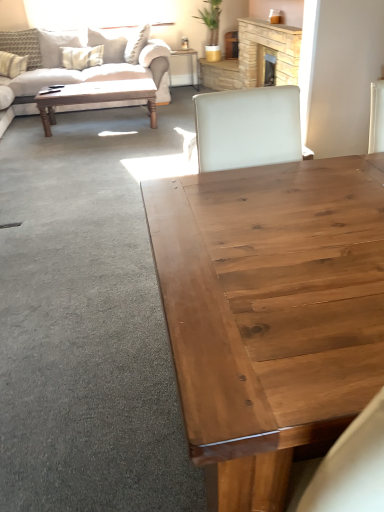
At what (x,y) coordinates should I click in order to perform the action: click on wooden polished coffee table at upper left, the first coffee table when ordered from left to right. Please return your answer as a coordinate pair (x, y). Image resolution: width=384 pixels, height=512 pixels. Looking at the image, I should click on (97, 97).

In order to click on white textured pillow at upper left, the 1th pillow when ordered from right to left in this screenshot , I will do `click(59, 44)`.

How much space does white textured pillow at upper left, the 1th pillow when ordered from right to left, occupy vertically?

21.38 inches.

Image resolution: width=384 pixels, height=512 pixels. Describe the element at coordinates (191, 63) in the screenshot. I see `wooden desk at center` at that location.

This screenshot has width=384, height=512. I want to click on natural wood coffee table at center, arranged as the 1th coffee table when viewed from the front, so click(270, 312).

You are a GUI agent. You are given a task and a screenshot of the screen. Output one action in this format:
    pyautogui.click(x=<x>, y=<y>)
    Task: Click on the desk on the right of patterned fabric pillow at upper left, which is counted as the 2th pillow, starting from the left
    This screenshot has width=384, height=512.
    Given the screenshot: What is the action you would take?
    pyautogui.click(x=191, y=63)

From the image's perspective, is patterned fabric pillow at upper left, which is counted as the 2th pillow, starting from the left, on wooden desk at center?

Correct, patterned fabric pillow at upper left, which is counted as the 2th pillow, starting from the left, appears higher than wooden desk at center in the image.

Can you confirm if patterned fabric pillow at upper left, which appears as the second pillow when viewed from the right, is smaller than wooden desk at center?

No.

Considering the sizes of objects beige fabric pillow at upper left, the 1th pillow viewed from the left, and white textured pillow at upper left, the 1th pillow when ordered from right to left, in the image provided, who is smaller, beige fabric pillow at upper left, the 1th pillow viewed from the left, or white textured pillow at upper left, the 1th pillow when ordered from right to left,?

Smaller between the two is beige fabric pillow at upper left, the 1th pillow viewed from the left.

From the image's perspective, who appears lower, beige fabric pillow at upper left, the 1th pillow viewed from the left, or white textured pillow at upper left, the 1th pillow when ordered from right to left?

beige fabric pillow at upper left, the 1th pillow viewed from the left, is shown below in the image.

Could you tell me if beige fabric pillow at upper left, the 1th pillow viewed from the left, is turned towards white textured pillow at upper left, which ranks as the 3th pillow in left-to-right order?

No, beige fabric pillow at upper left, the 1th pillow viewed from the left, is not facing towards white textured pillow at upper left, which ranks as the 3th pillow in left-to-right order.

From the image's perspective, is patterned fabric pillow at upper left, which is counted as the 2th pillow, starting from the left, under beige fabric pillow at upper left, the 1th pillow viewed from the left?

No, from the image's perspective, patterned fabric pillow at upper left, which is counted as the 2th pillow, starting from the left, is not beneath beige fabric pillow at upper left, the 1th pillow viewed from the left.

From the picture: Is patterned fabric pillow at upper left, which is counted as the 2th pillow, starting from the left, inside or outside of beige fabric pillow at upper left, the 1th pillow viewed from the left?

patterned fabric pillow at upper left, which is counted as the 2th pillow, starting from the left, is spatially situated outside beige fabric pillow at upper left, the 1th pillow viewed from the left.

Based on the photo, is patterned fabric pillow at upper left, which appears as the second pillow when viewed from the right, taller than beige fabric pillow at upper left, the third pillow when ordered from right to left?

Indeed, patterned fabric pillow at upper left, which appears as the second pillow when viewed from the right, has a greater height compared to beige fabric pillow at upper left, the third pillow when ordered from right to left.

Which object is positioned more to the right, patterned fabric pillow at upper left, which is counted as the 2th pillow, starting from the left, or beige fabric pillow at upper left, the third pillow when ordered from right to left?

patterned fabric pillow at upper left, which is counted as the 2th pillow, starting from the left, is more to the right.

Could you tell me if wooden desk at center is turned towards beige fabric pillow at upper left, the third pillow when ordered from right to left?

No, wooden desk at center is not turned towards beige fabric pillow at upper left, the third pillow when ordered from right to left.

Which of these two, wooden desk at center or beige fabric pillow at upper left, the 1th pillow viewed from the left, stands shorter?

beige fabric pillow at upper left, the 1th pillow viewed from the left, is shorter.

Based on the photo, which is in front, wooden desk at center or beige fabric pillow at upper left, the 1th pillow viewed from the left?

beige fabric pillow at upper left, the 1th pillow viewed from the left, is in front.

Does stone fireplace at upper center appear on the left side of wooden desk at center?

No.

Which is closer to the camera, (244, 21) or (192, 71)?

Point (244, 21) is positioned closer to the camera compared to point (192, 71).

Can you tell me how much stone fireplace at upper center and wooden desk at center differ in facing direction?

The angle between the facing direction of stone fireplace at upper center and the facing direction of wooden desk at center is 90.7 degrees.

Could you tell me if stone fireplace at upper center is turned towards wooden desk at center?

No, stone fireplace at upper center does not turn towards wooden desk at center.

Is stone fireplace at upper center far from wooden polished coffee table at upper left, the first coffee table when ordered from left to right?

Yes, stone fireplace at upper center and wooden polished coffee table at upper left, the first coffee table when ordered from left to right, are located far from each other.

From the image's perspective, relative to wooden polished coffee table at upper left, the first coffee table when ordered from top to bottom, is stone fireplace at upper center above or below?

From the image's perspective, stone fireplace at upper center appears above wooden polished coffee table at upper left, the first coffee table when ordered from top to bottom.

Is stone fireplace at upper center not within wooden polished coffee table at upper left, the 1th coffee table when ordered from back to front?

stone fireplace at upper center is positioned outside wooden polished coffee table at upper left, the 1th coffee table when ordered from back to front.

Does stone fireplace at upper center have a greater height compared to wooden polished coffee table at upper left, placed as the 2th coffee table when sorted from right to left?

Correct, stone fireplace at upper center is much taller as wooden polished coffee table at upper left, placed as the 2th coffee table when sorted from right to left.

Is patterned fabric pillow at upper left, which is counted as the 2th pillow, starting from the left, aimed at beige fabric couch at upper left?

Yes, patterned fabric pillow at upper left, which is counted as the 2th pillow, starting from the left, faces towards beige fabric couch at upper left.

How different are the orientations of patterned fabric pillow at upper left, which appears as the second pillow when viewed from the right, and beige fabric couch at upper left in degrees?

2.21 degrees separate the facing orientations of patterned fabric pillow at upper left, which appears as the second pillow when viewed from the right, and beige fabric couch at upper left.

Considering the relative sizes of patterned fabric pillow at upper left, which appears as the second pillow when viewed from the right, and beige fabric couch at upper left in the image provided, is patterned fabric pillow at upper left, which appears as the second pillow when viewed from the right, wider than beige fabric couch at upper left?

In fact, patterned fabric pillow at upper left, which appears as the second pillow when viewed from the right, might be narrower than beige fabric couch at upper left.

Is patterned fabric pillow at upper left, which appears as the second pillow when viewed from the right, situated inside beige fabric couch at upper left or outside?

patterned fabric pillow at upper left, which appears as the second pillow when viewed from the right, exists entirely within beige fabric couch at upper left.

Where is `the 2nd pillow in front of the wooden desk at center`? The width and height of the screenshot is (384, 512). the 2nd pillow in front of the wooden desk at center is located at coordinates (23, 45).

Find the location of a particular element. pillow that appears below the white textured pillow at upper left, which ranks as the 3th pillow in left-to-right order (from a real-world perspective) is located at coordinates (12, 64).

Looking at the image, which one is located closer to stone fireplace at upper center, natural wood coffee table at center, marked as the 1th coffee table in a right-to-left arrangement, or wooden desk at center?

wooden desk at center is closer to stone fireplace at upper center.

When comparing their distances from patterned fabric pillow at upper left, which is counted as the 2th pillow, starting from the left, does stone fireplace at upper center or wooden polished coffee table at upper left, which is counted as the second coffee table, starting from the bottom, seem closer?

The object closer to patterned fabric pillow at upper left, which is counted as the 2th pillow, starting from the left, is wooden polished coffee table at upper left, which is counted as the second coffee table, starting from the bottom.

Looking at the image, which one is located further to beige fabric pillow at upper left, the third pillow when ordered from right to left, wooden polished coffee table at upper left, placed as the 2th coffee table when sorted from right to left, or natural wood coffee table at center, arranged as the 1th coffee table when viewed from the front?

natural wood coffee table at center, arranged as the 1th coffee table when viewed from the front.

Which object lies further to the anchor point white textured pillow at upper left, the 1th pillow when ordered from right to left, wooden desk at center or beige fabric pillow at upper left, the third pillow when ordered from right to left?

wooden desk at center.

When comparing their distances from beige fabric couch at upper left, does patterned fabric pillow at upper left, which is counted as the 2th pillow, starting from the left, or wooden desk at center seem further?

Among the two, patterned fabric pillow at upper left, which is counted as the 2th pillow, starting from the left, is located further to beige fabric couch at upper left.

When comparing their distances from beige fabric couch at upper left, does wooden polished coffee table at upper left, the first coffee table when ordered from left to right, or wooden desk at center seem further?

Among the two, wooden desk at center is located further to beige fabric couch at upper left.

Estimate the real-world distances between objects in this image. Which object is further from stone fireplace at upper center, beige fabric couch at upper left or natural wood coffee table at center, placed as the 2th coffee table when sorted from back to front?

Among the two, natural wood coffee table at center, placed as the 2th coffee table when sorted from back to front, is located further to stone fireplace at upper center.

From the image, which object appears to be farther from beige fabric pillow at upper left, the third pillow when ordered from right to left, white textured pillow at upper left, the 1th pillow when ordered from right to left, or beige fabric couch at upper left?

beige fabric couch at upper left is positioned further to the anchor beige fabric pillow at upper left, the third pillow when ordered from right to left.

In order to click on desk situated between beige fabric pillow at upper left, the 1th pillow viewed from the left, and stone fireplace at upper center from left to right in this screenshot , I will do `click(191, 63)`.

Identify the location of pillow located between patterned fabric pillow at upper left, which appears as the second pillow when viewed from the right, and stone fireplace at upper center in the left-right direction. The width and height of the screenshot is (384, 512). (59, 44).

I want to click on coffee table located between natural wood coffee table at center, arranged as the second coffee table when viewed from the top, and white textured pillow at upper left, which ranks as the 3th pillow in left-to-right order, in the depth direction, so click(97, 97).

Locate an element on the screen. studio couch between natural wood coffee table at center, which ranks as the first coffee table in bottom-to-top order, and patterned fabric pillow at upper left, which is counted as the 2th pillow, starting from the left, from front to back is located at coordinates (89, 74).